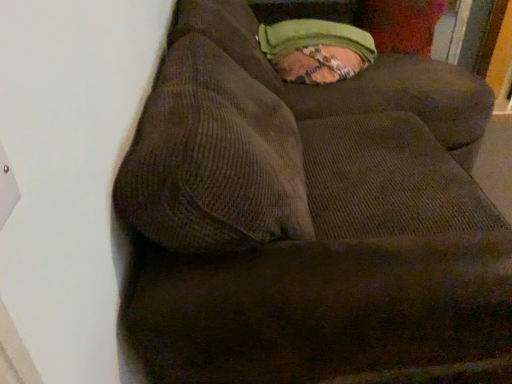
What is the approximate width of green corduroy pillow at upper right?

29.35 centimeters.

Identify the location of green corduroy pillow at upper right. The width and height of the screenshot is (512, 384). (400, 24).

The image size is (512, 384). What do you see at coordinates (400, 24) in the screenshot? I see `green corduroy pillow at upper right` at bounding box center [400, 24].

Where is `green corduroy pillow at upper right`? green corduroy pillow at upper right is located at coordinates (400, 24).